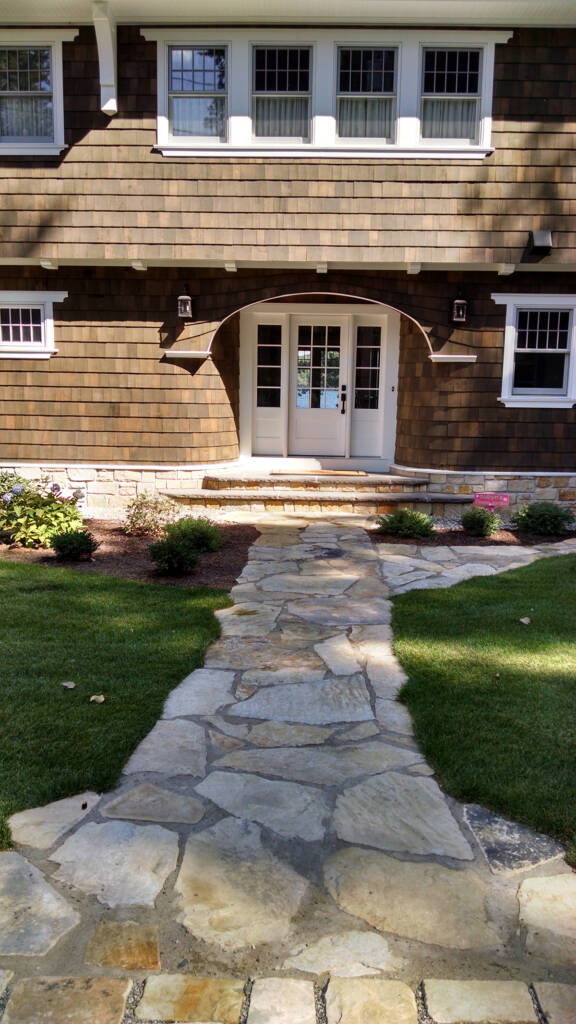
The width and height of the screenshot is (576, 1024). I want to click on vent, so click(x=538, y=240).